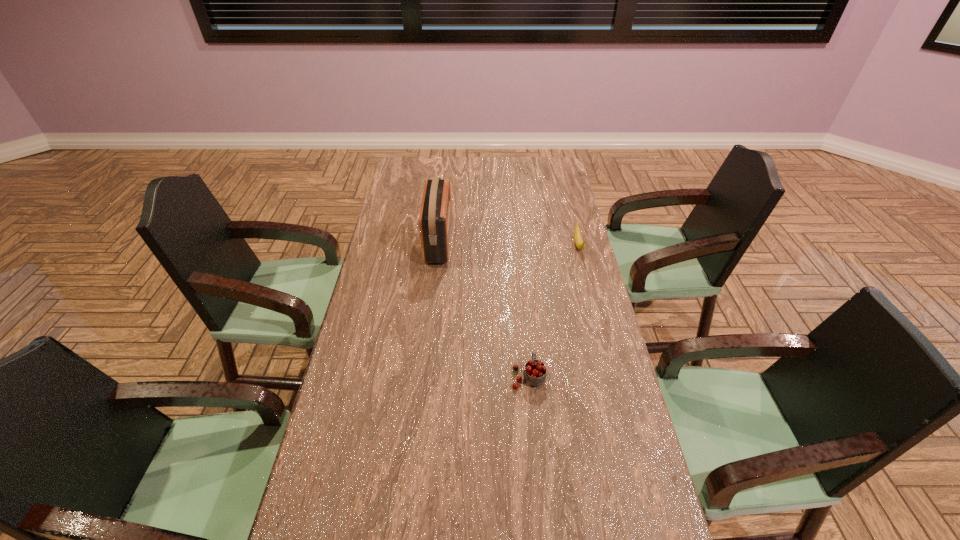
Identify the location of free point between the shortest object and the tallest object. The height and width of the screenshot is (540, 960). (509, 244).

This screenshot has height=540, width=960. What are the coordinates of `vacant area that lies between the shortest object and the second object from right to left` in the screenshot? It's located at (553, 310).

Image resolution: width=960 pixels, height=540 pixels. I want to click on vacant space in between the rightmost object and the cherry, so click(x=553, y=310).

Identify the location of vacant point located between the radio receiver and the second tallest object. This screenshot has width=960, height=540. (484, 309).

Where is `free space between the banana and the radio receiver`? free space between the banana and the radio receiver is located at coordinates (509, 244).

Find the location of a particular element. object that stands as the second closest to the second tallest object is located at coordinates (579, 242).

You are a GUI agent. You are given a task and a screenshot of the screen. Output one action in this format:
    pyautogui.click(x=<x>, y=<y>)
    Task: Click on the object that can be found as the closest to the leftmost object
    The image size is (960, 540).
    Given the screenshot: What is the action you would take?
    [535, 371]

The image size is (960, 540). In order to click on free space that satisfies the following two spatial constraints: 1. on the front-facing side of the radio receiver; 2. on the handle side of the second object from left to right in this screenshot , I will do `click(424, 376)`.

You are a GUI agent. You are given a task and a screenshot of the screen. Output one action in this format:
    pyautogui.click(x=<x>, y=<y>)
    Task: Click on the vacant space that satisfies the following two spatial constraints: 1. on the front-facing side of the leftmost object; 2. on the handle side of the second object from right to left
    The image size is (960, 540).
    Given the screenshot: What is the action you would take?
    pyautogui.click(x=424, y=376)

Find the location of a particular element. The width and height of the screenshot is (960, 540). blank area in the image that satisfies the following two spatial constraints: 1. on the front-facing side of the tallest object; 2. on the handle side of the cherry is located at coordinates (424, 376).